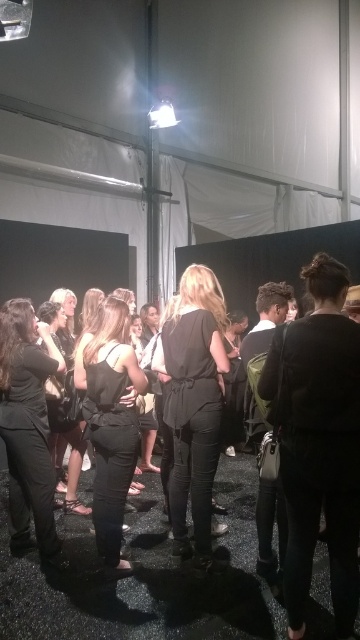
You are a photographer standing at the edge of the stage, and you want to take a closeup shot of both the matte black blouse at center and the matte black top at center. Can you fit both in your camera frame if your camera has a minimum focus distance of 30 inches?

The distance between the matte black blouse at center and the matte black top at center is 30.99 inches, which is slightly more than the camera frame can handle at 30 inches. Therefore, you might need to step back a bit to include both in the shot.

From the picture: You are standing in the venue and want to move from the point at coordinates point (205, 561) to the point at coordinates point (45, 465). Which direction should you move to get closer to the latter?

You should move downward and to the left because point (45, 465) is located below and to the left of point (205, 561).

You are standing in the industrial venue and want to reach the point marked as point (189, 554). Given that the distance between you and this point is 2.99 meters, can you estimate how many steps it would take you to walk there if each of your steps is approximately 0.75 meters long?

The distance between you and point (189, 554) is 2.99 meters. If each step is 0.75 meters, dividing 2.99 by 0.75 gives approximately 4 steps. Therefore, it would take about 4 steps to reach point (189, 554).